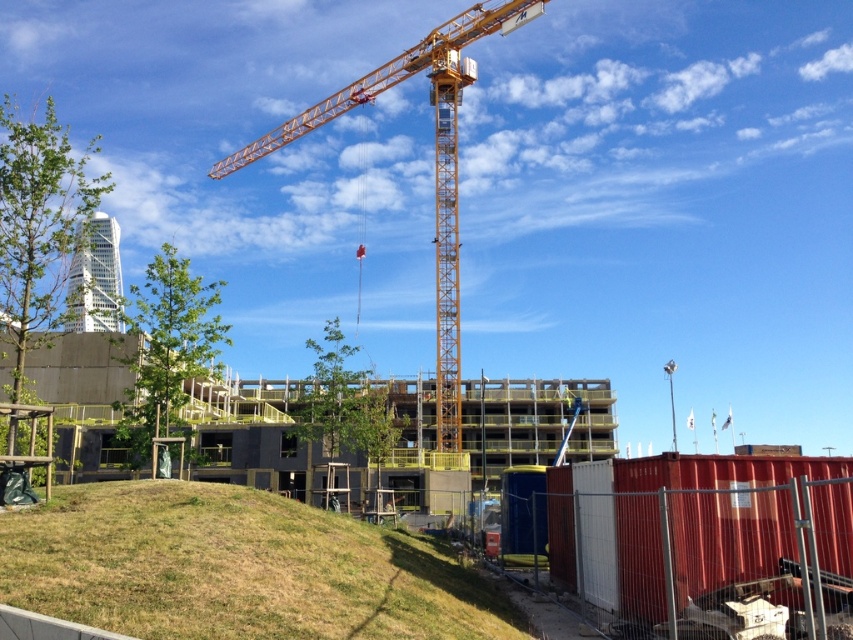
You are a construction worker standing on the green grassy hill at lower left and need to reach the yellow metallic crane at center. Which direction should you walk to get there?

The green grassy hill at lower left is positioned on the right side of the yellow metallic crane at center, so you should walk to the left to reach the yellow metallic crane at center.

You are a construction worker standing at the center of the construction site. You need to place a new safety sign exactly at the location of the green grassy hill at lower left. What are the coordinates where you should place the safety sign?

The coordinates for the green grassy hill at lower left are at point (236, 568), so you should place the safety sign at those coordinates.

You are a construction worker standing on the green grassy hill at lower left and need to reach the yellow metallic crane at center to operate it. Is the crane within your direct line of sight from your current position?

The green grassy hill at lower left is positioned under the yellow metallic crane at center, so the crane is directly above you and within your line of sight.